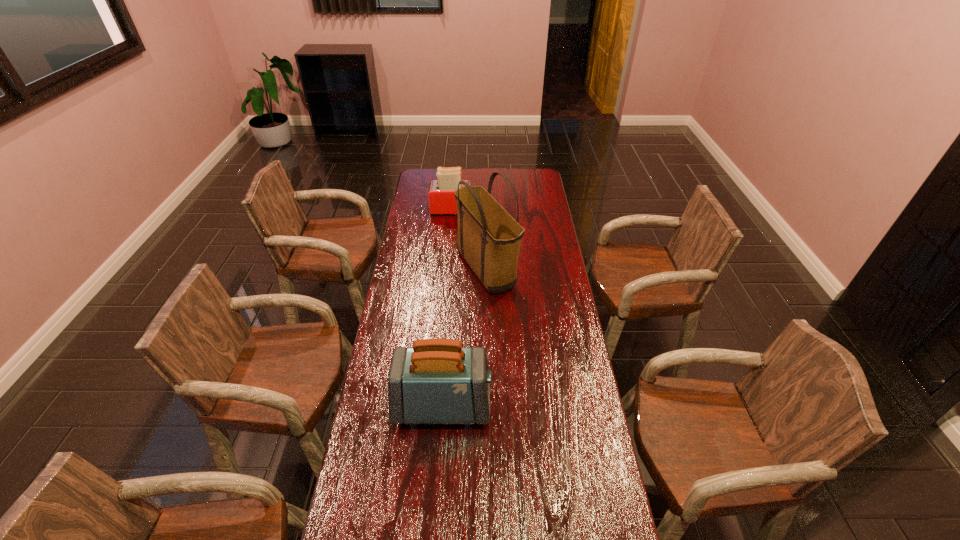
Locate an element on the screen. the second nearest object is located at coordinates (489, 239).

You are a GUI agent. You are given a task and a screenshot of the screen. Output one action in this format:
    pyautogui.click(x=<x>, y=<y>)
    Task: Click on the tallest object
    The width and height of the screenshot is (960, 540).
    Given the screenshot: What is the action you would take?
    pyautogui.click(x=489, y=239)

This screenshot has width=960, height=540. I want to click on the second tallest object, so click(x=437, y=381).

Find the location of a particular element. the nearest object is located at coordinates (437, 381).

You are a GUI agent. You are given a task and a screenshot of the screen. Output one action in this format:
    pyautogui.click(x=<x>, y=<y>)
    Task: Click on the farthest object
    
    Given the screenshot: What is the action you would take?
    pyautogui.click(x=442, y=201)

At what (x,y) coordinates should I click in order to perform the action: click on the shortest object. Please return your answer as a coordinate pair (x, y). Image resolution: width=960 pixels, height=540 pixels. Looking at the image, I should click on (442, 201).

At what (x,y) coordinates should I click in order to perform the action: click on free spot located 0.100m on the front of the tote bag. Please return your answer as a coordinate pair (x, y). This screenshot has height=540, width=960. Looking at the image, I should click on (488, 321).

Where is `vacant area situated 0.130m on the front-facing side of the nearest object`? This screenshot has width=960, height=540. vacant area situated 0.130m on the front-facing side of the nearest object is located at coordinates (530, 406).

I want to click on blank space located on the front-facing side of the farther toaster, so click(514, 210).

The image size is (960, 540). What are the coordinates of `vacant space at the left edge of the desktop` in the screenshot? It's located at (413, 242).